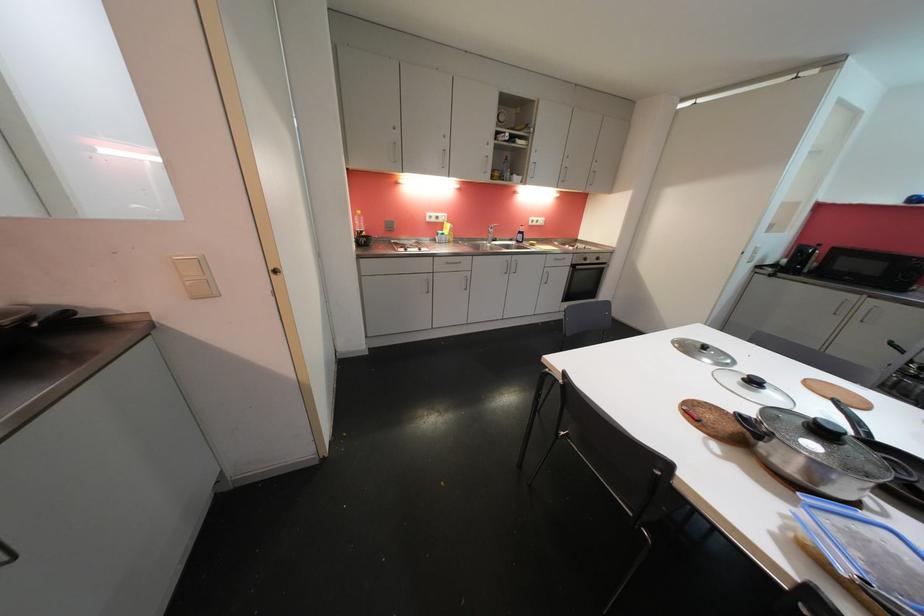
Identify the location of stovetop dial. [x=716, y=549].